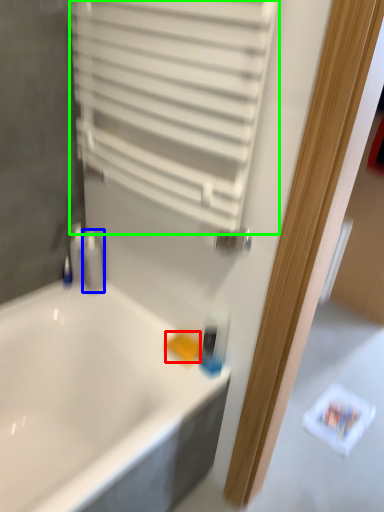
Question: Based on their relative distances, which object is nearer to soap (highlighted by a red box)? Choose from toiletry (highlighted by a blue box) and shutter (highlighted by a green box).

Choices:
 (A) toiletry
 (B) shutter

Answer: (A)